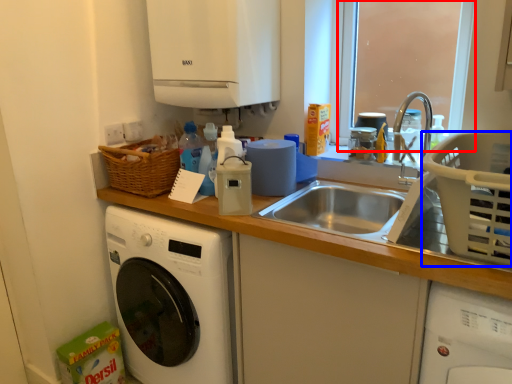
Question: Which of the following is the closest to the observer, window screen (highlighted by a red box) or basket (highlighted by a blue box)?

Choices:
 (A) window screen
 (B) basket

Answer: (B)